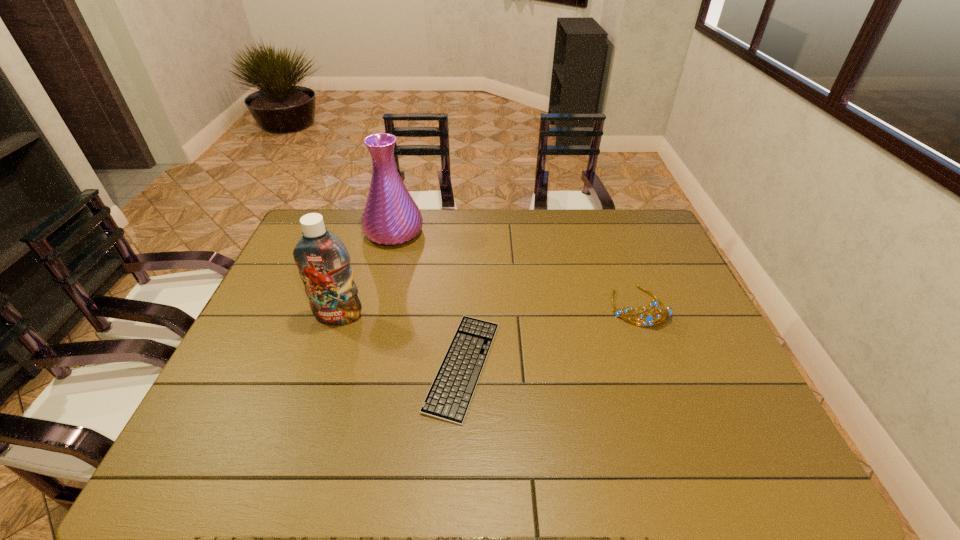
You are a GUI agent. You are given a task and a screenshot of the screen. Output one action in this format:
    pyautogui.click(x=<x>, y=<y>)
    Task: Click on the object positioned at the far edge
    The image size is (960, 540).
    Given the screenshot: What is the action you would take?
    pyautogui.click(x=390, y=217)

At what (x,y) coordinates should I click in order to perform the action: click on object at the right edge. Please return your answer as a coordinate pair (x, y). The height and width of the screenshot is (540, 960). Looking at the image, I should click on (648, 319).

This screenshot has width=960, height=540. I want to click on vacant space at the far edge of the desktop, so click(x=579, y=210).

Where is `vacant space at the right edge of the desktop`? This screenshot has width=960, height=540. vacant space at the right edge of the desktop is located at coordinates (632, 266).

This screenshot has width=960, height=540. In the image, there is a desktop. In order to click on vacant area at the far left corner in this screenshot , I will do `click(343, 223)`.

This screenshot has height=540, width=960. In the image, there is a desktop. Find the location of `vacant space at the near left corner`. vacant space at the near left corner is located at coordinates (238, 450).

Image resolution: width=960 pixels, height=540 pixels. What are the coordinates of `empty location between the vase and the second shortest object` in the screenshot? It's located at (516, 269).

The image size is (960, 540). Find the location of `unoccupied position between the third tallest object and the shampoo`. unoccupied position between the third tallest object and the shampoo is located at coordinates (489, 312).

Identify the location of free spot between the farthest object and the computer keyboard. (428, 299).

Locate an element on the screen. free area in between the farthest object and the shampoo is located at coordinates click(367, 274).